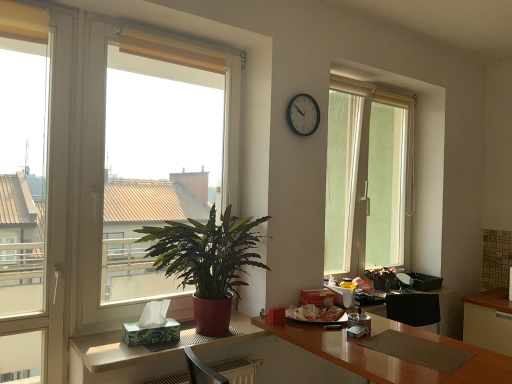
I want to click on green glossy plant at left, which is the 1th houseplant in left-to-right order, so click(x=207, y=262).

Identify the location of beige fabric curtain at upper center. The height and width of the screenshot is (384, 512). (170, 51).

What is the approximate height of white cardboard tissue at lower left?

white cardboard tissue at lower left is 17.57 centimeters tall.

This screenshot has height=384, width=512. Identify the location of white glossy cabinet at lower right. (488, 320).

The width and height of the screenshot is (512, 384). I want to click on transparent glass window at center, so click(367, 177).

In order to click on green glossy plant at left, which is the 1th houseplant from front to back in this screenshot , I will do `click(207, 262)`.

Considering the sizes of brown glossy desk at center and white glossy cabinet at lower right in the image, is brown glossy desk at center bigger or smaller than white glossy cabinet at lower right?

Considering their sizes, brown glossy desk at center takes up more space than white glossy cabinet at lower right.

Identify the location of desk in front of the white glossy cabinet at lower right. (389, 356).

Is point (397, 364) positioned behind point (504, 323)?

No, it is in front of (504, 323).

Considering the sizes of objects brown glossy desk at center and white glossy cabinet at lower right in the image provided, who is taller, brown glossy desk at center or white glossy cabinet at lower right?

Standing taller between the two is white glossy cabinet at lower right.

From a real-world perspective, is beige fabric curtain at upper center below brown glossy desk at center?

Actually, beige fabric curtain at upper center is physically above brown glossy desk at center in the real world.

Considering the sizes of beige fabric curtain at upper center and brown glossy desk at center in the image, is beige fabric curtain at upper center taller or shorter than brown glossy desk at center?

Considering their sizes, beige fabric curtain at upper center has less height than brown glossy desk at center.

Is beige fabric curtain at upper center wider or thinner than brown glossy desk at center?

Clearly, beige fabric curtain at upper center has less width compared to brown glossy desk at center.

From the image's perspective, which object appears higher, beige fabric curtain at upper center or brown glossy desk at center?

beige fabric curtain at upper center is shown above in the image.

Is transparent glass window at center positioned beyond the bounds of beige fabric curtain at upper center?

Yes.

Is transparent glass window at center thinner than beige fabric curtain at upper center?

No.

From the picture: From the image's perspective, does transparent glass window at center appear higher than beige fabric curtain at upper center?

No, from the image's perspective, transparent glass window at center is not over beige fabric curtain at upper center.

Is transparent glass window at center next to beige fabric curtain at upper center?

transparent glass window at center is not next to beige fabric curtain at upper center, and they're not touching.

Considering the positions of objects white glossy cabinet at lower right and green leafy plant at center, which ranks as the 2th houseplant in front-to-back order, in the image provided, who is more to the left, white glossy cabinet at lower right or green leafy plant at center, which ranks as the 2th houseplant in front-to-back order,?

green leafy plant at center, which ranks as the 2th houseplant in front-to-back order.

From a real-world perspective, which is physically below, white glossy cabinet at lower right or green leafy plant at center, which ranks as the 2th houseplant in front-to-back order?

white glossy cabinet at lower right, from a real-world perspective.

Looking at this image, from the image's perspective, which one is positioned lower, white glossy cabinet at lower right or green leafy plant at center, placed as the 1th houseplant when sorted from right to left?

From the image's view, white glossy cabinet at lower right is below.

Is white plastic clock at upper center aimed at white glossy table at lower left?

No, white plastic clock at upper center is not turned towards white glossy table at lower left.

Is white plastic clock at upper center at the right side of white glossy table at lower left?

Correct, you'll find white plastic clock at upper center to the right of white glossy table at lower left.

How different are the orientations of white plastic clock at upper center and white glossy table at lower left in degrees?

They differ by 0.000899 degrees in their facing directions.

Is white plastic clock at upper center not within white glossy table at lower left?

Yes.

From the image's perspective, relative to brown glossy desk at center, is green leafy plant at left above or below?

Based on their image positions, green leafy plant at left is located above brown glossy desk at center.

Is green leafy plant at left not close to brown glossy desk at center?

Indeed, green leafy plant at left is not near brown glossy desk at center.

From a real-world perspective, is green leafy plant at left physically located above or below brown glossy desk at center?

green leafy plant at left is above brown glossy desk at center.

Is green glossy plant at left, positioned as the second houseplant in back-to-front order, looking in the opposite direction of white glossy table at lower left?

No, green glossy plant at left, positioned as the second houseplant in back-to-front order, is not facing away from white glossy table at lower left.

From the image's perspective, which one is positioned higher, green glossy plant at left, which is the 1th houseplant in left-to-right order, or white glossy table at lower left?

green glossy plant at left, which is the 1th houseplant in left-to-right order.

Between green glossy plant at left, the second houseplant from the right, and white glossy table at lower left, which one has less height?

white glossy table at lower left.

Locate an element on the screen. The height and width of the screenshot is (384, 512). kitchen & dining room table below the green glossy plant at left, which is the 1th houseplant from front to back (from the image's perspective) is located at coordinates (112, 351).

The image size is (512, 384). What are the coordinates of `cabinetry below the brown glossy desk at center (from a real-world perspective)` in the screenshot? It's located at (488, 320).

You are a GUI agent. You are given a task and a screenshot of the screen. Output one action in this format:
    pyautogui.click(x=<x>, y=<y>)
    Task: Click on the curtain that appears on the left of brown glossy desk at center
    The height and width of the screenshot is (384, 512).
    Given the screenshot: What is the action you would take?
    pyautogui.click(x=170, y=51)

Which object lies further to the anchor point white cardboard tissue at lower left, transparent glass window at center or brown glossy desk at center?

Based on the image, transparent glass window at center appears to be further to white cardboard tissue at lower left.

Estimate the real-world distances between objects in this image. Which object is closer to brown glossy desk at center, white glossy cabinet at lower right or white glossy table at lower left?

Among the two, white glossy table at lower left is located nearer to brown glossy desk at center.

Looking at the image, which one is located closer to green leafy plant at left, transparent glass window at center or white glossy cabinet at lower right?

The object closer to green leafy plant at left is transparent glass window at center.

Which object lies nearer to the anchor point white glossy cabinet at lower right, green leafy plant at left or white plastic clock at upper center?

white plastic clock at upper center is closer to white glossy cabinet at lower right.

In the scene shown: From the image, which object appears to be farther from green leafy plant at center, which ranks as the 2th houseplant in front-to-back order, transparent glass window at center or beige fabric curtain at upper center?

Among the two, beige fabric curtain at upper center is located further to green leafy plant at center, which ranks as the 2th houseplant in front-to-back order.

Based on their spatial positions, is green leafy plant at center, which ranks as the 2th houseplant in front-to-back order, or transparent glass window at center closer to white plastic clock at upper center?

transparent glass window at center.

Estimate the real-world distances between objects in this image. Which object is closer to white glossy table at lower left, white cardboard tissue at lower left or beige fabric curtain at upper center?

white cardboard tissue at lower left is closer to white glossy table at lower left.

Consider the image. When comparing their distances from white cardboard tissue at lower left, does green leafy plant at left or white glossy table at lower left seem closer?

white glossy table at lower left is positioned closer to the anchor white cardboard tissue at lower left.

The width and height of the screenshot is (512, 384). Find the location of `clock situated between white glossy table at lower left and white glossy cabinet at lower right from left to right`. clock situated between white glossy table at lower left and white glossy cabinet at lower right from left to right is located at coordinates pyautogui.click(x=303, y=114).

The width and height of the screenshot is (512, 384). What are the coordinates of `houseplant located between white glossy table at lower left and brown glossy desk at center in the left-right direction` in the screenshot? It's located at (207, 262).

The width and height of the screenshot is (512, 384). I want to click on clock between beige fabric curtain at upper center and white glossy table at lower left in the vertical direction, so click(x=303, y=114).

This screenshot has width=512, height=384. What are the coordinates of `bay window that lies between white plastic clock at upper center and white glossy table at lower left from top to bottom` in the screenshot? It's located at tap(157, 152).